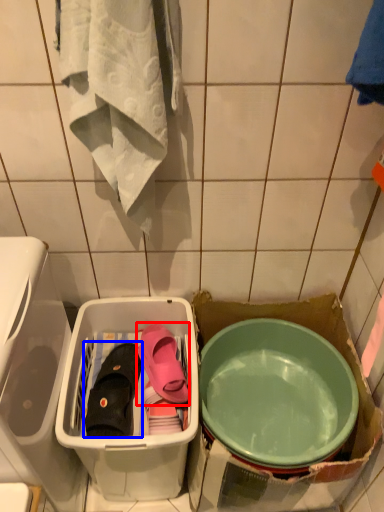
Question: Which point is further to the camera, footwear (highlighted by a red box) or footwear (highlighted by a blue box)?

Choices:
 (A) footwear
 (B) footwear

Answer: (A)